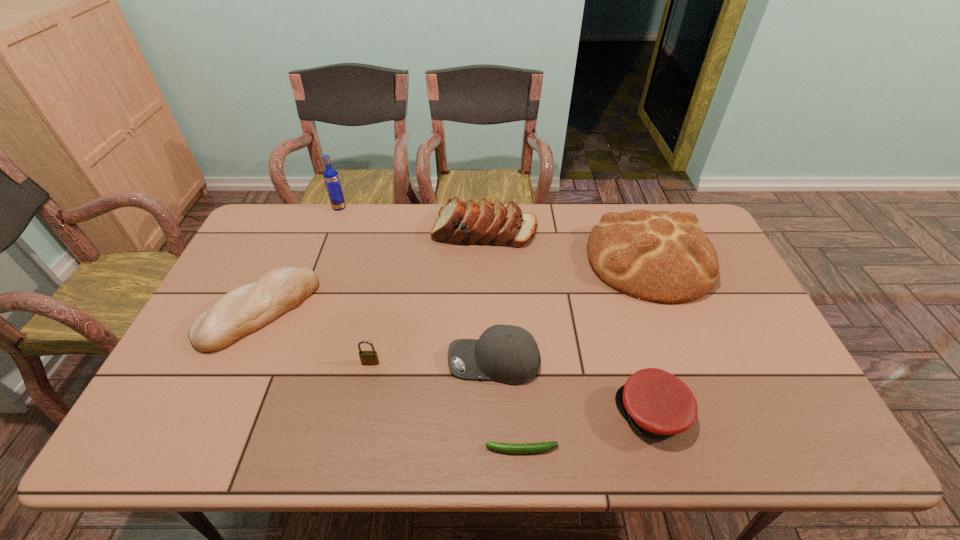
Locate an element on the screen. The image size is (960, 540). vacant space located 0.250m on the right of the tallest object is located at coordinates (413, 207).

Locate an element on the screen. free space located on the back of the rightmost bread is located at coordinates (627, 203).

This screenshot has width=960, height=540. In order to click on free region located on the right of the second bread from right to left in this screenshot , I will do `click(648, 231)`.

Identify the location of free location located on the front brim of the baseball cap. The width and height of the screenshot is (960, 540). (334, 362).

Find the location of `free space located 0.260m on the front brim of the baseball cap`. free space located 0.260m on the front brim of the baseball cap is located at coordinates (349, 362).

You are a GUI agent. You are given a task and a screenshot of the screen. Output one action in this format:
    pyautogui.click(x=<x>, y=<y>)
    Task: Click on the vacant point located 0.340m on the front brim of the baseball cap
    
    Given the screenshot: What is the action you would take?
    pyautogui.click(x=319, y=362)

Where is `free space located on the right of the padlock`? free space located on the right of the padlock is located at coordinates (493, 363).

Find the location of `vacant space located on the right of the shortest bread`. vacant space located on the right of the shortest bread is located at coordinates (359, 311).

The image size is (960, 540). What are the coordinates of `vacant region located 0.110m at the front of the cap where the visor is located` in the screenshot? It's located at click(x=572, y=414).

You are a GUI agent. You are given a task and a screenshot of the screen. Output one action in this format:
    pyautogui.click(x=<x>, y=<y>)
    Task: Click on the vacant area situated at the front of the cap where the visor is located
    
    Given the screenshot: What is the action you would take?
    pyautogui.click(x=588, y=414)